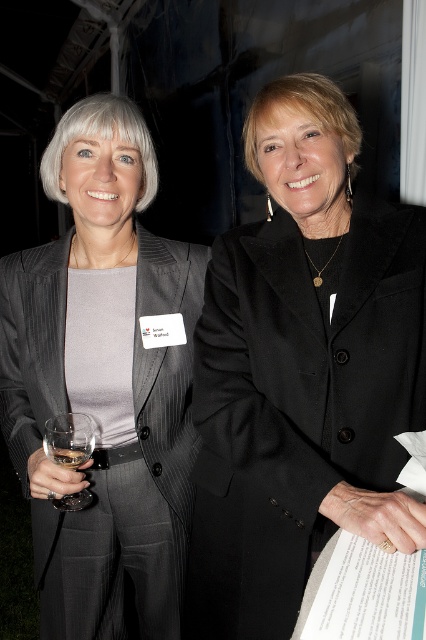
Question: Which point is closer to the camera?

Choices:
 (A) clear glass wine at lower left
 (B) matte black suit at left
 (C) black woolen blazer at right
 (D) clear glass wine glass at left

Answer: (C)

Question: Is black woolen blazer at right thinner than matte black suit at left?

Choices:
 (A) yes
 (B) no

Answer: (A)

Question: Which of the following is the closest to the observer?

Choices:
 (A) clear glass wine glass at left
 (B) clear glass wine at lower left

Answer: (A)

Question: Can you confirm if black woolen blazer at right is smaller than clear glass wine at lower left?

Choices:
 (A) no
 (B) yes

Answer: (A)

Question: Which point is farther from the camera taking this photo?

Choices:
 (A) (62, 465)
 (B) (48, 444)
 (C) (247, 490)
 (D) (65, 278)

Answer: (D)

Question: Is clear glass wine glass at left to the left of clear glass wine at lower left from the viewer's perspective?

Choices:
 (A) yes
 (B) no

Answer: (A)